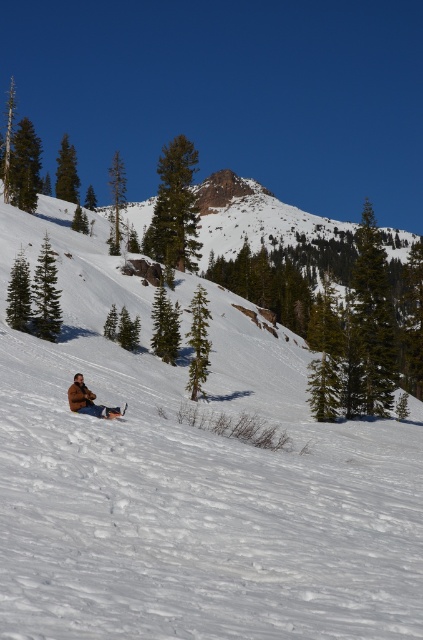
Question: Does brown fuzzy jacket at lower left appear under white plastic snowboard at lower center?

Choices:
 (A) yes
 (B) no

Answer: (B)

Question: Which of the following is the farthest from the observer?

Choices:
 (A) brown fuzzy jacket at lower left
 (B) white plastic snowboard at lower center
 (C) white powdery snow at center

Answer: (B)

Question: From the image, what is the correct spatial relationship of white powdery snow at center in relation to white plastic snowboard at lower center?

Choices:
 (A) above
 (B) below

Answer: (A)

Question: Is brown fuzzy jacket at lower left bigger than white plastic snowboard at lower center?

Choices:
 (A) yes
 (B) no

Answer: (A)

Question: Which point is closer to the camera?

Choices:
 (A) white powdery snow at center
 (B) brown fuzzy jacket at lower left
 (C) white plastic snowboard at lower center

Answer: (A)

Question: Which is farther from the white plastic snowboard at lower center?

Choices:
 (A) brown fuzzy jacket at lower left
 (B) white powdery snow at center

Answer: (B)